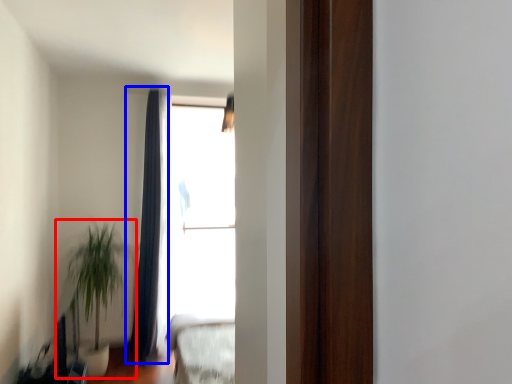
Question: Among these objects, which one is farthest to the camera, houseplant (highlighted by a red box) or curtain (highlighted by a blue box)?

Choices:
 (A) houseplant
 (B) curtain

Answer: (B)